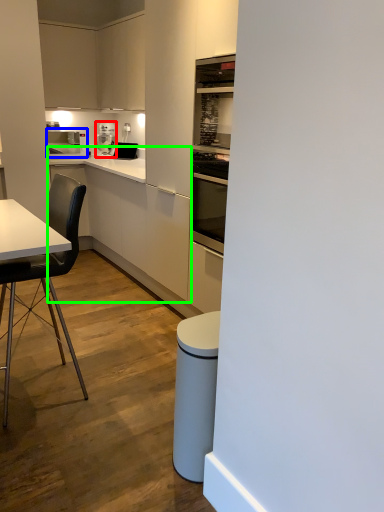
Question: Based on their relative distances, which object is nearer to kitchen appliance (highlighted by a red box)? Choose from kitchen appliance (highlighted by a blue box) and counter (highlighted by a green box).

Choices:
 (A) kitchen appliance
 (B) counter

Answer: (A)